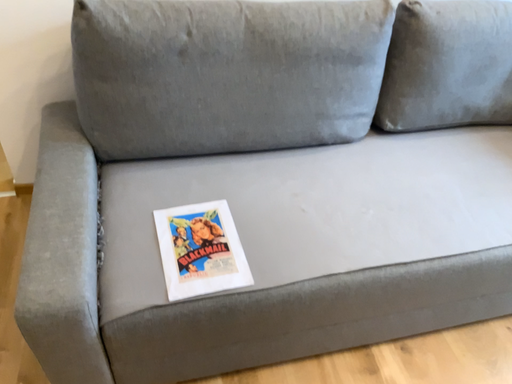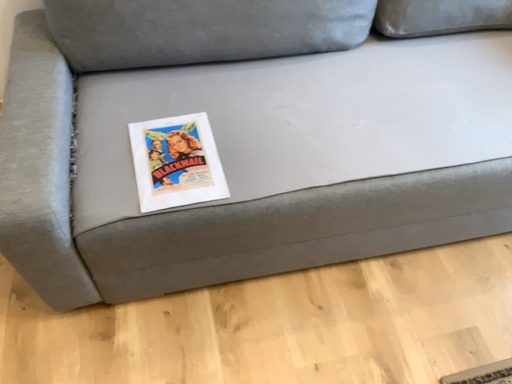
Question: Which way did the camera rotate in the video?

Choices:
 (A) rotated upward
 (B) rotated downward

Answer: (B)